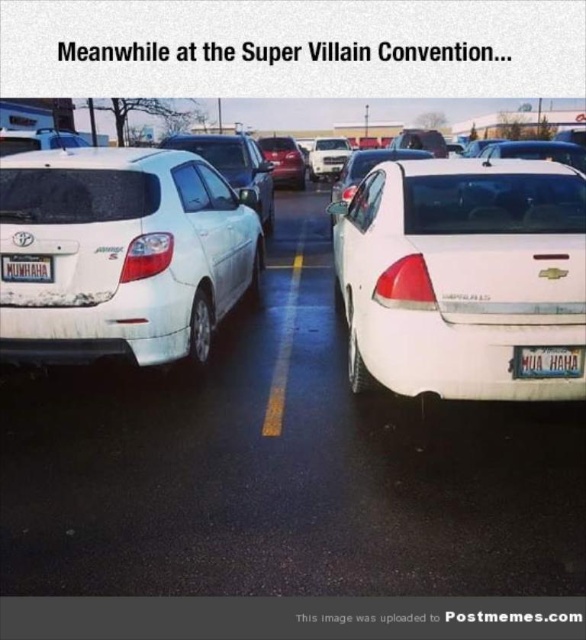
Question: Which of the following is the farthest from the observer?

Choices:
 (A) white glossy sedan at right
 (B) white matte car at center
 (C) white matte hatchback at left
 (D) metallic blue license plate at center

Answer: (C)

Question: Does white matte hatchback at left have a smaller size compared to white plastic license plate at center?

Choices:
 (A) no
 (B) yes

Answer: (A)

Question: Is metallic blue license plate at center above shiny red car at center?

Choices:
 (A) no
 (B) yes

Answer: (A)

Question: Can you confirm if white matte hatchback at left is positioned below white plastic license plate at center?

Choices:
 (A) no
 (B) yes

Answer: (A)

Question: Which point is farther from the camera taking this photo?

Choices:
 (A) (420, 540)
 (B) (360, 346)
 (C) (520, 348)

Answer: (B)

Question: Which of the following is the closest to the observer?

Choices:
 (A) white glossy sedan at right
 (B) white plastic license plate at center

Answer: (A)